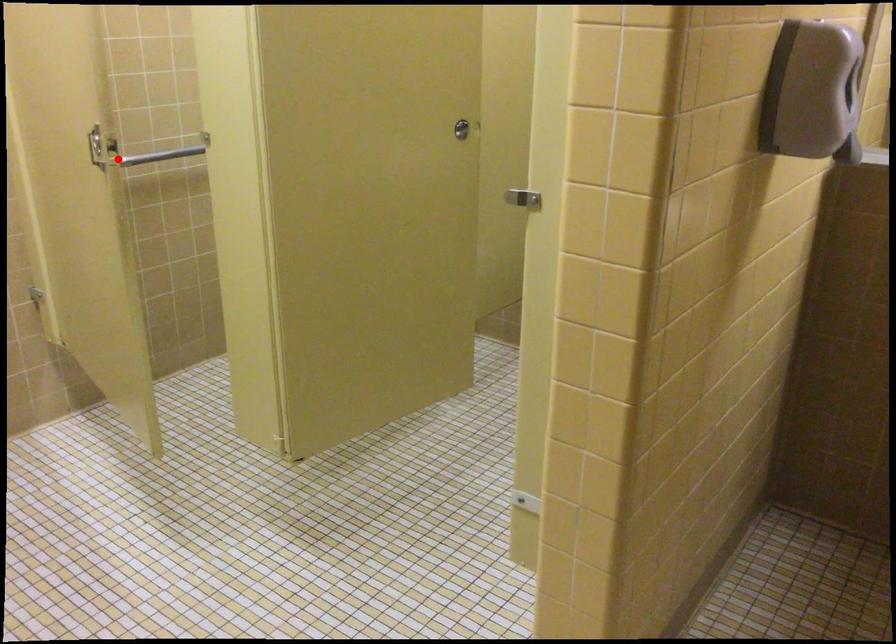
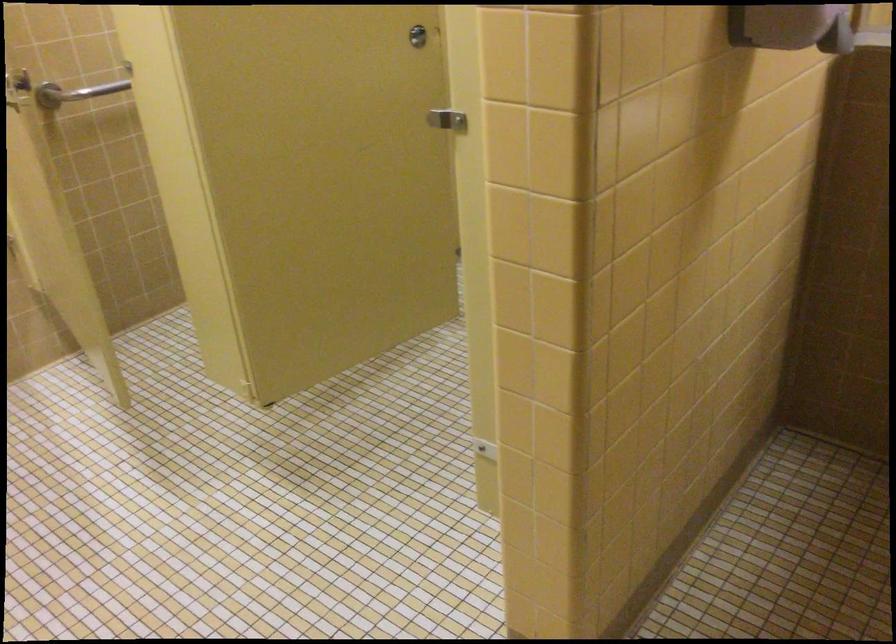
Locate, in the second image, the point that corresponds to the highlighted location in the first image.

(75, 91)